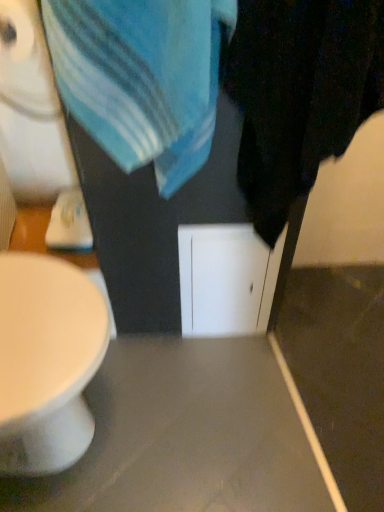
Where is `vacant region below blue cotton towel at upper center (from a real-world perspective)`? This screenshot has height=512, width=384. vacant region below blue cotton towel at upper center (from a real-world perspective) is located at coordinates (175, 374).